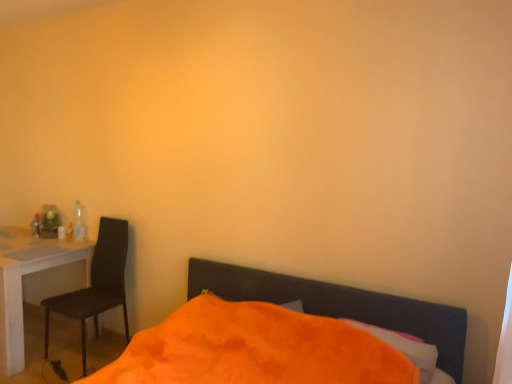
Describe the element at coordinates (97, 284) in the screenshot. Image resolution: width=512 pixels, height=384 pixels. I see `black matte chair at left` at that location.

Identify the location of orange soft pillow at lower center. (405, 348).

What do you see at coordinates (405, 348) in the screenshot? This screenshot has width=512, height=384. I see `orange soft pillow at lower center` at bounding box center [405, 348].

Measure the distance between translucent plastic bottle at left and camera.

translucent plastic bottle at left and camera are 11.19 feet apart.

Find the location of a particular element. This screenshot has height=384, width=512. orange fuzzy bed at lower center is located at coordinates (340, 304).

Locate an element on the screen. This screenshot has height=384, width=512. black matte chair at left is located at coordinates tap(97, 284).

From the image's perspective, is orange fuzzy bed at lower center under translucent plastic bottle at left?

Yes.

Between orange fuzzy bed at lower center and translucent plastic bottle at left, which one has larger size?

With larger size is orange fuzzy bed at lower center.

Consider the image. From a real-world perspective, is orange fuzzy bed at lower center beneath translucent plastic bottle at left?

Yes, from a real-world perspective, orange fuzzy bed at lower center is below translucent plastic bottle at left.

Is orange fuzzy bed at lower center outside of translucent plastic bottle at left?

orange fuzzy bed at lower center is positioned outside translucent plastic bottle at left.

Between black matte chair at left and orange fuzzy bed at lower center, which one has larger size?

With larger size is orange fuzzy bed at lower center.

Considering the sizes of objects black matte chair at left and orange fuzzy bed at lower center in the image provided, who is thinner, black matte chair at left or orange fuzzy bed at lower center?

Thinner between the two is black matte chair at left.

Considering the relative sizes of black matte chair at left and orange fuzzy bed at lower center in the image provided, is black matte chair at left shorter than orange fuzzy bed at lower center?

No, black matte chair at left is not shorter than orange fuzzy bed at lower center.

From the image's perspective, is white glossy desk at left located beneath translucent plastic bottle at left?

Correct, white glossy desk at left appears lower than translucent plastic bottle at left in the image.

How different are the orientations of white glossy desk at left and translucent plastic bottle at left in degrees?

1.04 degrees.

Is white glossy desk at left placed right next to translucent plastic bottle at left?

No, white glossy desk at left is not next to translucent plastic bottle at left.

Considering the sizes of white glossy desk at left and translucent plastic bottle at left in the image, is white glossy desk at left taller or shorter than translucent plastic bottle at left?

white glossy desk at left is taller than translucent plastic bottle at left.

Is translucent plastic bottle at left wider or thinner than white glossy desk at left?

Clearly, translucent plastic bottle at left has less width compared to white glossy desk at left.

Is translucent plastic bottle at left smaller than white glossy desk at left?

Correct, translucent plastic bottle at left occupies less space than white glossy desk at left.

From the picture: Could you tell me if translucent plastic bottle at left is turned towards white glossy desk at left?

No, translucent plastic bottle at left is not turned towards white glossy desk at left.

Is translucent plastic bottle at left in contact with white glossy desk at left?

translucent plastic bottle at left is not next to white glossy desk at left, and they're not touching.

Considering the sizes of objects white glossy desk at left and black matte chair at left in the image provided, who is smaller, white glossy desk at left or black matte chair at left?

Smaller between the two is black matte chair at left.

In the image, is white glossy desk at left on the left side or the right side of black matte chair at left?

From the image, it's evident that white glossy desk at left is to the left of black matte chair at left.

Does white glossy desk at left lie in front of black matte chair at left?

No, white glossy desk at left is further to the viewer.

This screenshot has width=512, height=384. I want to click on chair that appears above the white glossy desk at left (from a real-world perspective), so click(97, 284).

Between orange soft pillow at lower center and white glossy desk at left, which one has smaller width?

orange soft pillow at lower center.

Which is more to the left, orange soft pillow at lower center or white glossy desk at left?

white glossy desk at left is more to the left.

Is the depth of orange soft pillow at lower center less than that of white glossy desk at left?

Yes, the depth of orange soft pillow at lower center is less than that of white glossy desk at left.

Is orange soft pillow at lower center turned away from orange fuzzy bed at lower center?

That's right, orange soft pillow at lower center is facing away from orange fuzzy bed at lower center.

Does orange soft pillow at lower center contain orange fuzzy bed at lower center?

No, orange fuzzy bed at lower center is not inside orange soft pillow at lower center.

Between orange soft pillow at lower center and orange fuzzy bed at lower center, which one is positioned in front?

Positioned in front is orange fuzzy bed at lower center.

From a real-world perspective, which object rests below the other?

orange fuzzy bed at lower center, from a real-world perspective.

Where is `bed below the translucent plastic bottle at left (from a real-world perspective)`? bed below the translucent plastic bottle at left (from a real-world perspective) is located at coordinates (340, 304).

Where is `bed that appears in front of the black matte chair at left`? Image resolution: width=512 pixels, height=384 pixels. bed that appears in front of the black matte chair at left is located at coordinates (340, 304).

Considering their positions, is white glossy desk at left positioned further to orange soft pillow at lower center than orange fuzzy bed at lower center?

white glossy desk at left is positioned further to the anchor orange soft pillow at lower center.

Looking at the image, which one is located closer to orange soft pillow at lower center, orange fuzzy bed at lower center or white glossy desk at left?

orange fuzzy bed at lower center.

Looking at the image, which one is located closer to white glossy desk at left, black matte chair at left or translucent plastic bottle at left?

Based on the image, black matte chair at left appears to be nearer to white glossy desk at left.

Looking at the image, which one is located closer to white glossy desk at left, orange fuzzy bed at lower center or translucent plastic bottle at left?

translucent plastic bottle at left lies closer to white glossy desk at left than the other object.

Estimate the real-world distances between objects in this image. Which object is closer to orange fuzzy bed at lower center, black matte chair at left or translucent plastic bottle at left?

black matte chair at left lies closer to orange fuzzy bed at lower center than the other object.

Which object lies nearer to the anchor point white glossy desk at left, orange fuzzy bed at lower center or black matte chair at left?

black matte chair at left lies closer to white glossy desk at left than the other object.

Consider the image. When comparing their distances from orange fuzzy bed at lower center, does orange soft pillow at lower center or white glossy desk at left seem further?

white glossy desk at left.

Based on their spatial positions, is translucent plastic bottle at left or orange fuzzy bed at lower center closer to white glossy desk at left?

translucent plastic bottle at left is positioned closer to the anchor white glossy desk at left.

Locate an element on the screen. chair located between white glossy desk at left and orange soft pillow at lower center in the left-right direction is located at coordinates (97, 284).

Locate an element on the screen. The width and height of the screenshot is (512, 384). chair positioned between orange fuzzy bed at lower center and white glossy desk at left from near to far is located at coordinates (97, 284).

You are a GUI agent. You are given a task and a screenshot of the screen. Output one action in this format:
    pyautogui.click(x=<x>, y=<y>)
    Task: Click on the pillow between orange fuzzy bed at lower center and black matte chair at left along the z-axis
    The width and height of the screenshot is (512, 384).
    Given the screenshot: What is the action you would take?
    pyautogui.click(x=405, y=348)

Identify the location of desk positioned between orange fuzzy bed at lower center and translucent plastic bottle at left from near to far. [22, 282].